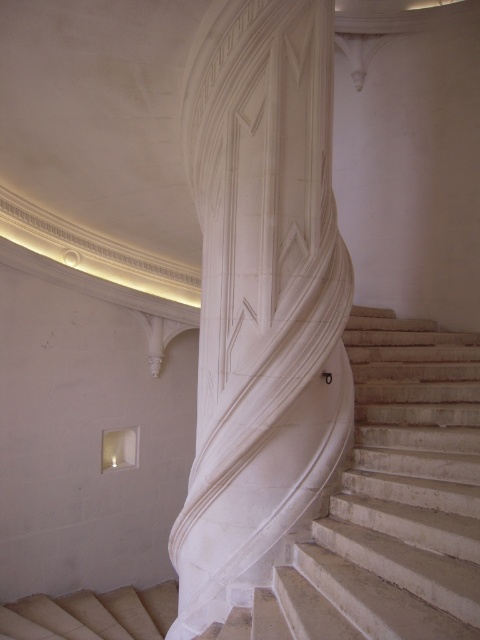
Question: In this image, where is white marble pillar at center located relative to white marble stairs at center?

Choices:
 (A) left
 (B) right

Answer: (A)

Question: Among these points, which one is nearest to the camera?

Choices:
 (A) (437, 513)
 (B) (249, 104)

Answer: (A)

Question: Which of the following is the farthest from the observer?

Choices:
 (A) white marble pillar at center
 (B) white marble stairs at center
 (C) beige textured stairs at lower left

Answer: (C)

Question: Which object appears farthest from the camera in this image?

Choices:
 (A) white marble pillar at center
 (B) white marble stairs at center
 (C) beige textured stairs at lower left

Answer: (C)

Question: Is white marble pillar at center positioned before white marble stairs at center?

Choices:
 (A) no
 (B) yes

Answer: (A)

Question: From the image, what is the correct spatial relationship of white marble pillar at center in relation to white marble stairs at center?

Choices:
 (A) right
 (B) left

Answer: (B)